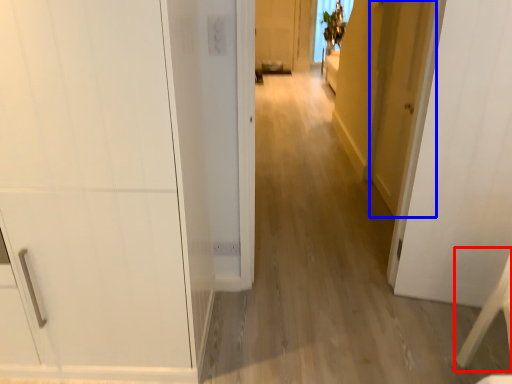
Question: Which of the following is the closest to the observer, furniture (highlighted by a red box) or door (highlighted by a blue box)?

Choices:
 (A) furniture
 (B) door

Answer: (A)